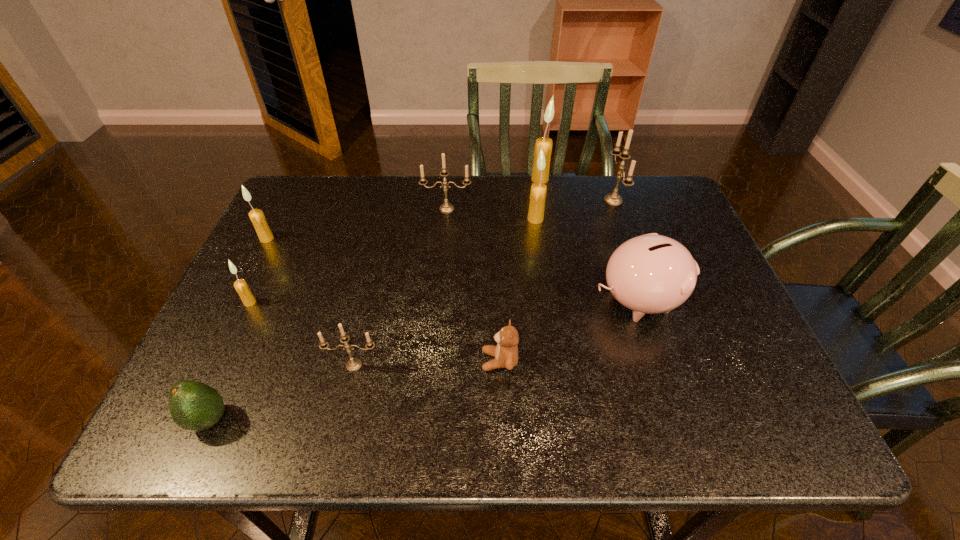
You are a GUI agent. You are given a task and a screenshot of the screen. Output one action in this format:
    pyautogui.click(x=<x>, y=<y>)
    Task: Click on the vacant area that lies between the green avocado and the nearest cream candle
    The width and height of the screenshot is (960, 540).
    Given the screenshot: What is the action you would take?
    (x=229, y=361)

Locate an element on the screen. free space that is in between the smallest metallic candle and the tallest object is located at coordinates (447, 272).

Identify the location of free space that is in between the pink piggy bank and the fifth farthest candle. This screenshot has height=540, width=960. (452, 269).

Locate an element on the screen. This screenshot has width=960, height=540. free area in between the farthest cream candle and the piggy bank is located at coordinates (588, 240).

Where is `vacant area between the fourth candle from left to right and the fourth object from left to right`? The height and width of the screenshot is (540, 960). vacant area between the fourth candle from left to right and the fourth object from left to right is located at coordinates (400, 287).

Locate an element on the screen. vacant point located between the fourth candle from right to left and the smallest metallic candle is located at coordinates (400, 287).

Where is `blank region between the nearest object and the piggy bank`? The image size is (960, 540). blank region between the nearest object and the piggy bank is located at coordinates (423, 360).

Where is `empty location between the teddy bear and the farthest cream candle`? The height and width of the screenshot is (540, 960). empty location between the teddy bear and the farthest cream candle is located at coordinates (519, 270).

Find the location of `free space between the rightmost candle and the nearest cream candle`. free space between the rightmost candle and the nearest cream candle is located at coordinates (432, 251).

Locate which object is the fifth closest to the leftmost metallic candle. Please provide its 2D coordinates. Your answer should be formatted as a tuple, i.e. [(x, y)], where the tuple contains the x and y coordinates of a point satisfying the conditions above.

[(649, 274)]